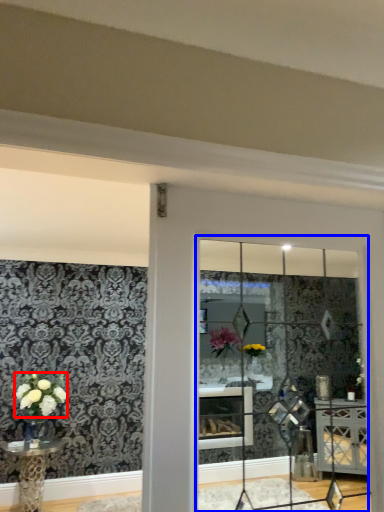
Question: Which object is further to the camera taking this photo, flower (highlighted by a red box) or glass window (highlighted by a blue box)?

Choices:
 (A) flower
 (B) glass window

Answer: (A)